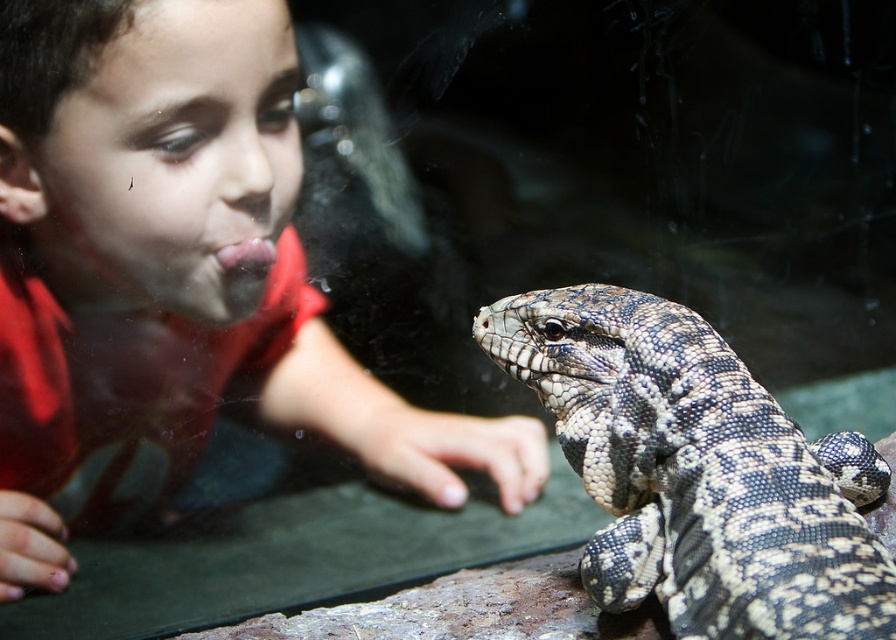
Question: Is matte red shirt at upper left smaller than speckled scaly lizard at center?

Choices:
 (A) yes
 (B) no

Answer: (B)

Question: Is matte red shirt at upper left thinner than speckled scaly lizard at center?

Choices:
 (A) no
 (B) yes

Answer: (A)

Question: Which of the following is the farthest from the observer?

Choices:
 (A) (35, 497)
 (B) (735, 628)

Answer: (A)

Question: Among these objects, which one is farthest from the camera?

Choices:
 (A) matte red shirt at upper left
 (B) speckled scaly lizard at center

Answer: (A)

Question: Is matte red shirt at upper left to the right of speckled scaly lizard at center from the viewer's perspective?

Choices:
 (A) yes
 (B) no

Answer: (B)